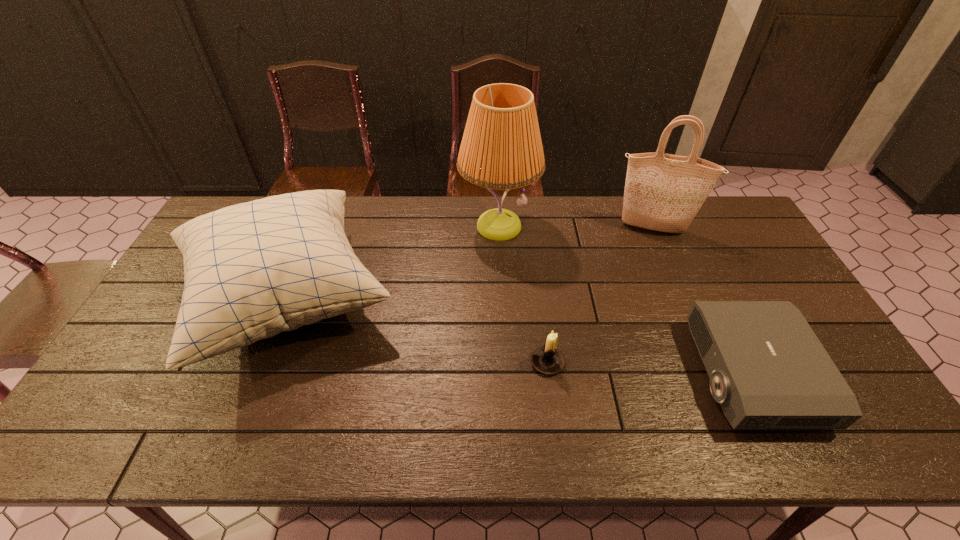
What are the coordinates of `lamp` in the screenshot? It's located at (501, 148).

Identify the location of shopping bag. (663, 192).

Where is `the leftmost object`? the leftmost object is located at coordinates (253, 270).

Where is `cushion`? cushion is located at coordinates (253, 270).

Locate an element on the screen. candle holder is located at coordinates (547, 359).

At what (x,y) coordinates should I click in order to perform the action: click on the shortest object. Please return your answer as a coordinate pair (x, y). The width and height of the screenshot is (960, 540). Looking at the image, I should click on click(768, 370).

Identify the location of free space located on the side of the lamp near the pull switch. (504, 353).

Where is `free location located on the left of the shopping bag`? Image resolution: width=960 pixels, height=540 pixels. free location located on the left of the shopping bag is located at coordinates (593, 228).

What are the coordinates of `free space located 0.200m on the right of the leftmost object` in the screenshot? It's located at (470, 299).

Find the location of a particular element. Image resolution: width=960 pixels, height=540 pixels. vacant space located 0.160m on the back of the candle holder is located at coordinates (540, 303).